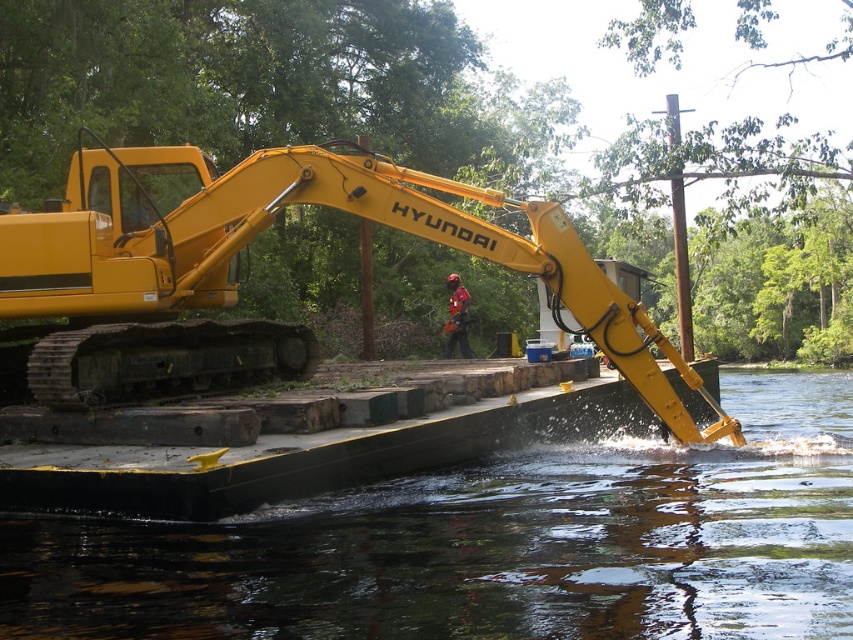
You are a worker on the construction site and need to move from the yellow rubber track at center to the black rubber boat at lower center. Which direction should you move to reach the boat?

The black rubber boat at lower center is positioned on the right side of the yellow rubber track at center. So you should move to the right to reach the boat.

You are operating a small boat and need to navigate between the black rubber boat at lower center and the yellow rubber track at center. Given their sizes, which one can you pass under more easily?

The black rubber boat at lower center is shorter than the yellow rubber track at center, so you can pass under the black rubber boat at lower center more easily.